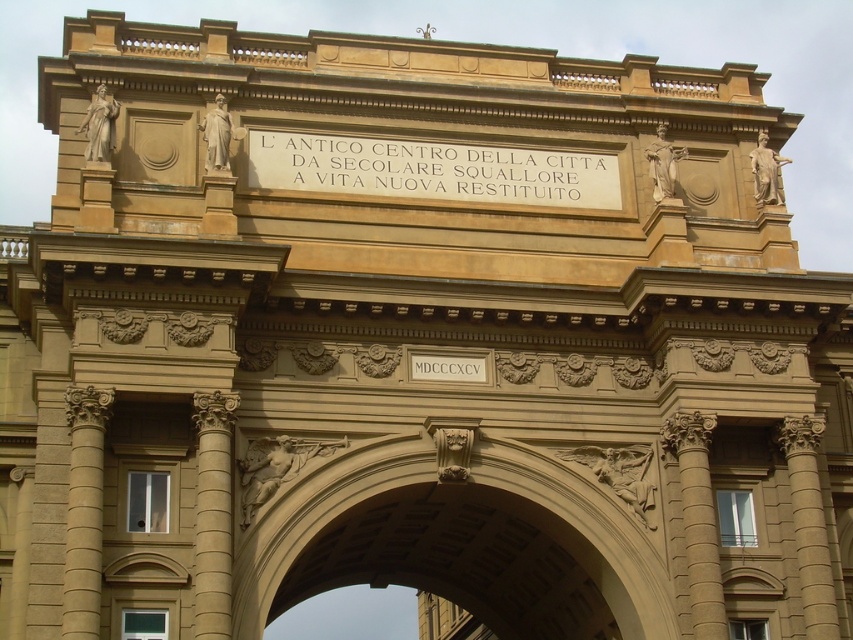
Question: Estimate the real-world distances between objects in this image. Which object is farther from the white stone plaque at center?

Choices:
 (A) beige stone column at center
 (B) beige stone column at left
 (C) brown stone column at right
 (D) smooth stone column at left

Answer: (D)

Question: Among these points, which one is farthest from the camera?

Choices:
 (A) (207, 586)
 (B) (628, 636)

Answer: (B)

Question: Can you confirm if white stone plaque at center is thinner than smooth stone column at left?

Choices:
 (A) yes
 (B) no

Answer: (B)

Question: Is the position of white stone plaque at center less distant than that of gold stone inscription at center?

Choices:
 (A) no
 (B) yes

Answer: (A)

Question: Does brown stone column at right appear on the right side of gold stone inscription at center?

Choices:
 (A) yes
 (B) no

Answer: (A)

Question: Which of the following is the farthest from the observer?

Choices:
 (A) white stone plaque at center
 (B) brown stone column at right
 (C) smooth stone column at left
 (D) gold stone inscription at center

Answer: (A)